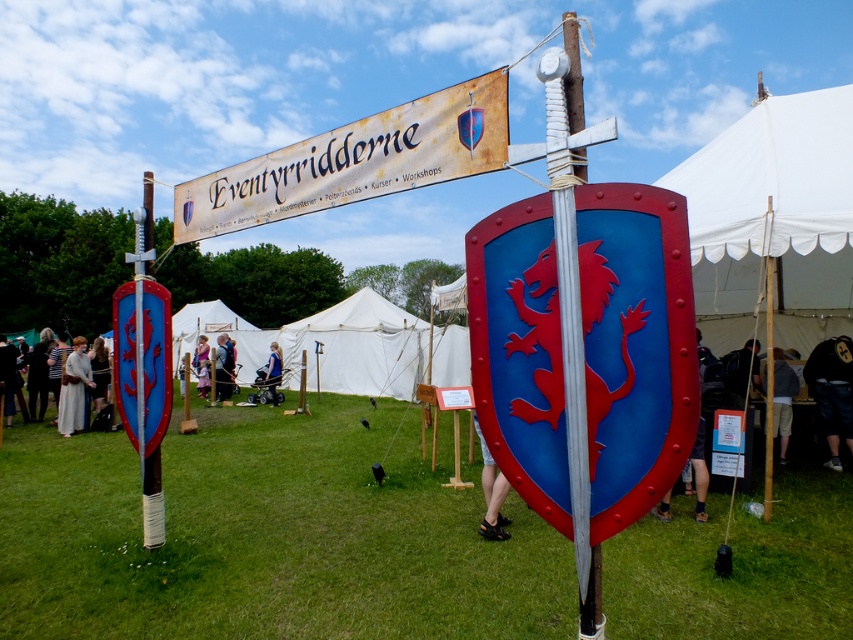
Question: Considering the real-world distances, which object is closest to the smooth beige tunic at center?

Choices:
 (A) blue fabric dress at center
 (B) white linen dress at lower left

Answer: (A)

Question: Does white canvas canopy at upper right appear on the left side of matte black shield at center?

Choices:
 (A) no
 (B) yes

Answer: (A)

Question: Is white canvas tent at center bigger than black leather jacket at lower right?

Choices:
 (A) no
 (B) yes

Answer: (B)

Question: Considering the real-world distances, which object is farthest from the matte blue shield at left?

Choices:
 (A) green grass at lower center
 (B) white canvas tent at center
 (C) dark gray fabric shirt at lower right

Answer: (B)

Question: Is matte blue shield at center bigger than white linen dress at lower left?

Choices:
 (A) no
 (B) yes

Answer: (B)

Question: Among these points, which one is nearest to the camera?

Choices:
 (A) (496, 531)
 (B) (270, 356)
 (C) (374, 337)
 (D) (392, 564)

Answer: (D)